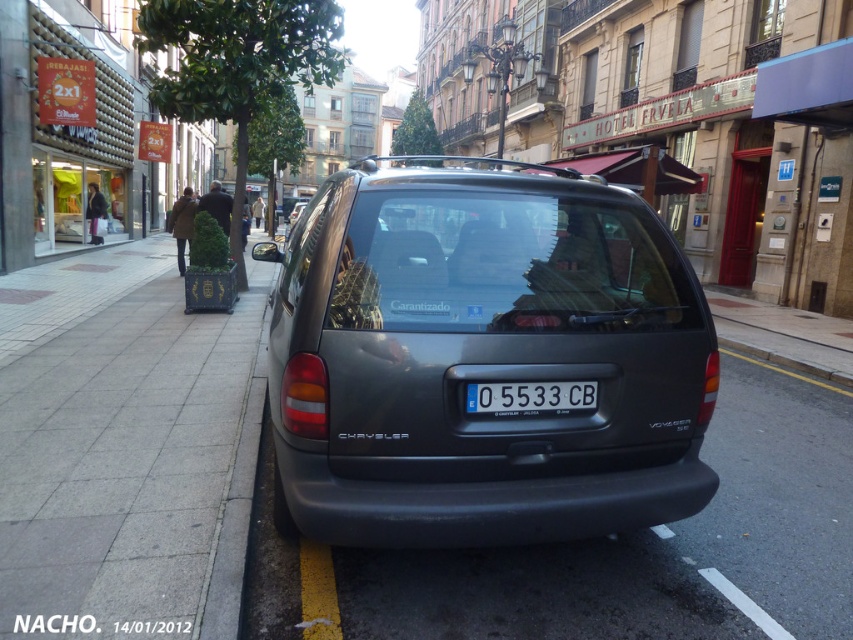
You are a delivery person who needs to park your 2.5 meter tall truck. You see the gray concrete pavement at lower left and the satin black van at center. Which location would allow your truck to fit vertically?

The satin black van at center is taller than the gray concrete pavement at lower left. Since your truck is 2.5 meters tall, you should park at the gray concrete pavement at lower left because it is shorter and your truck can fit vertically there.

You are a delivery person trying to park your van in this European city street. You see the gray concrete pavement at lower left and the satin black van at center. Which object is closer to you as you approach the scene from the street?

The gray concrete pavement at lower left is closer to you because it is in front of the satin black van at center, meaning the pavement is positioned nearer to your viewpoint as you approach the scene.